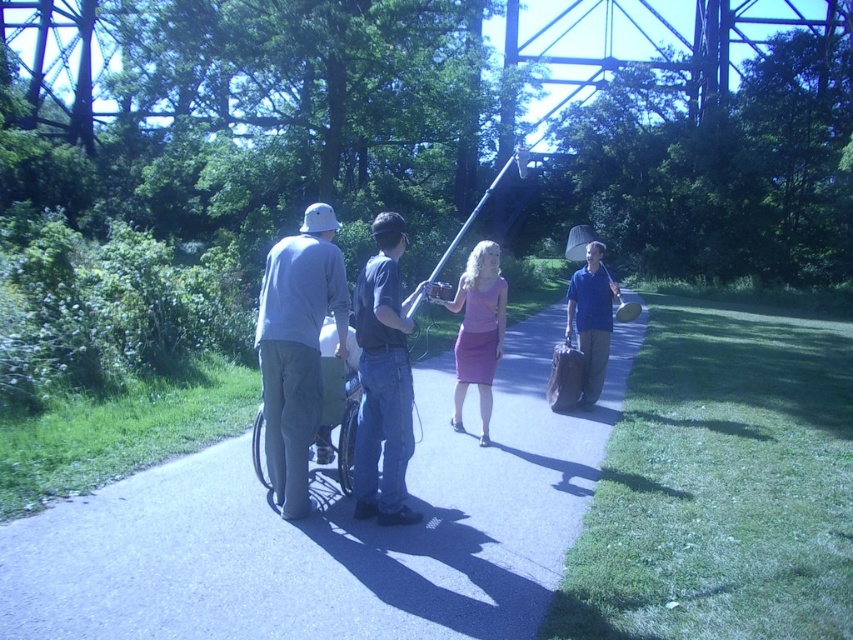
Which is in front, point (274, 516) or point (595, 305)?

Point (274, 516) is more forward.

Based on the photo, between asphalt pavement at center and blue cotton shirt at center-right, which one has more height?

blue cotton shirt at center-right

Is point (219, 588) positioned after point (578, 337)?

No.

Where is `asphalt pavement at center`? asphalt pavement at center is located at coordinates (332, 529).

In the scene shown: Is asphalt pavement at center shorter than gray cotton shirt at center?

Yes, asphalt pavement at center is shorter than gray cotton shirt at center.

Who is higher up, asphalt pavement at center or gray cotton shirt at center?

gray cotton shirt at center is higher up.

Is point (166, 600) in front of point (270, 452)?

Yes, it is.

Image resolution: width=853 pixels, height=640 pixels. In order to click on asphalt pavement at center in this screenshot , I will do `click(332, 529)`.

Who is lower down, asphalt pavement at center or denim jeans at center?

asphalt pavement at center

How distant is asphalt pavement at center from denim jeans at center?

asphalt pavement at center is 1.99 meters away from denim jeans at center.

The image size is (853, 640). Find the location of `asphalt pavement at center`. asphalt pavement at center is located at coordinates (332, 529).

Identify the location of asphalt pavement at center. Image resolution: width=853 pixels, height=640 pixels. (332, 529).